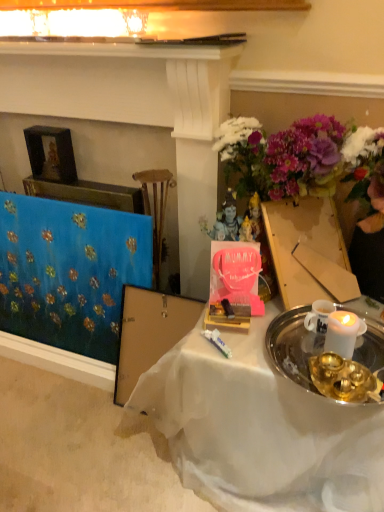
You are a GUI agent. You are given a task and a screenshot of the screen. Output one action in this format:
    pyautogui.click(x=<x>, y=<y>)
    Task: Click on the white sheer cloth at center
    This screenshot has width=384, height=512.
    Given the screenshot: What is the action you would take?
    pyautogui.click(x=260, y=429)

Where is `white sheer cloth at center`? white sheer cloth at center is located at coordinates (260, 429).

Can you confirm if blue fabric at left is positioned to the right of blue fabric at left?

Yes.

Is blue fabric at left shorter than blue fabric at left?

Yes, blue fabric at left is shorter than blue fabric at left.

Is blue fabric at left located outside blue fabric at left?

No, blue fabric at left is not entirely external to blue fabric at left.

From a real-world perspective, is blue fabric at left below blue fabric at left?

Correct, in the physical world, blue fabric at left is lower than blue fabric at left.

Which object is further away from the camera, white sheer cloth at center or blue fabric at left?

Positioned behind is blue fabric at left.

Considering the relative sizes of white sheer cloth at center and blue fabric at left in the image provided, is white sheer cloth at center smaller than blue fabric at left?

Correct, white sheer cloth at center occupies less space than blue fabric at left.

How different are the orientations of white sheer cloth at center and blue fabric at left in degrees?

There is a 0.000672-degree angle between the facing directions of white sheer cloth at center and blue fabric at left.

Identify the location of fireplace behind the white sheer cloth at center. This screenshot has height=512, width=384. (137, 111).

Is blue fabric at left situated inside white sheer cloth at center or outside?

blue fabric at left is not enclosed by white sheer cloth at center.

Which of these two, blue fabric at left or white sheer cloth at center, is smaller?

white sheer cloth at center.

From a real-world perspective, is blue fabric at left above or below white sheer cloth at center?

blue fabric at left is situated higher than white sheer cloth at center in the real world.

Is white sheer cloth at center looking in the opposite direction of blue fabric at left?

No.

From a real-world perspective, is white sheer cloth at center positioned above or below blue fabric at left?

white sheer cloth at center is situated lower than blue fabric at left in the real world.

Looking at the image, does white sheer cloth at center seem bigger or smaller compared to blue fabric at left?

white sheer cloth at center is bigger than blue fabric at left.

How many degrees apart are the facing directions of blue fabric at left and white sheer cloth at center?

The angle between the facing direction of blue fabric at left and the facing direction of white sheer cloth at center is 0.00149 degrees.

Can you confirm if blue fabric at left is wider than white sheer cloth at center?

Incorrect, the width of blue fabric at left does not surpass that of white sheer cloth at center.

In the scene shown: Would you say blue fabric at left is to the left or to the right of white sheer cloth at center in the picture?

Clearly, blue fabric at left is on the left of white sheer cloth at center in the image.

In the scene shown: Is blue fabric at left aimed at blue fabric at left?

Yes.

Where is `tablecloth located underneath the blue fabric at left (from a real-world perspective)`? This screenshot has height=512, width=384. tablecloth located underneath the blue fabric at left (from a real-world perspective) is located at coordinates coord(69,271).

How much distance is there between blue fabric at left and blue fabric at left?

15.20 inches.

Image resolution: width=384 pixels, height=512 pixels. What are the coordinates of `fireplace that is above the blue fabric at left (from a real-world perspective)` in the screenshot? It's located at (137, 111).

Locate an element on the screen. Image resolution: width=384 pixels, height=512 pixels. desk on the right of blue fabric at left is located at coordinates (260, 429).

Based on their spatial positions, is blue fabric at left or white sheer cloth at center further from blue fabric at left?

white sheer cloth at center.

When comparing their distances from white sheer cloth at center, does blue fabric at left or blue fabric at left seem further?

blue fabric at left is further to white sheer cloth at center.

When comparing their distances from blue fabric at left, does white sheer cloth at center or blue fabric at left seem further?

white sheer cloth at center is further to blue fabric at left.

Looking at the image, which one is located further to blue fabric at left, blue fabric at left or white sheer cloth at center?

Based on the image, white sheer cloth at center appears to be further to blue fabric at left.

When comparing their distances from white sheer cloth at center, does blue fabric at left or blue fabric at left seem closer?

Among the two, blue fabric at left is located nearer to white sheer cloth at center.

When comparing their distances from blue fabric at left, does white sheer cloth at center or blue fabric at left seem further?

Based on the image, white sheer cloth at center appears to be further to blue fabric at left.

Identify the location of tablecloth between blue fabric at left and white sheer cloth at center from left to right. The width and height of the screenshot is (384, 512). (69, 271).